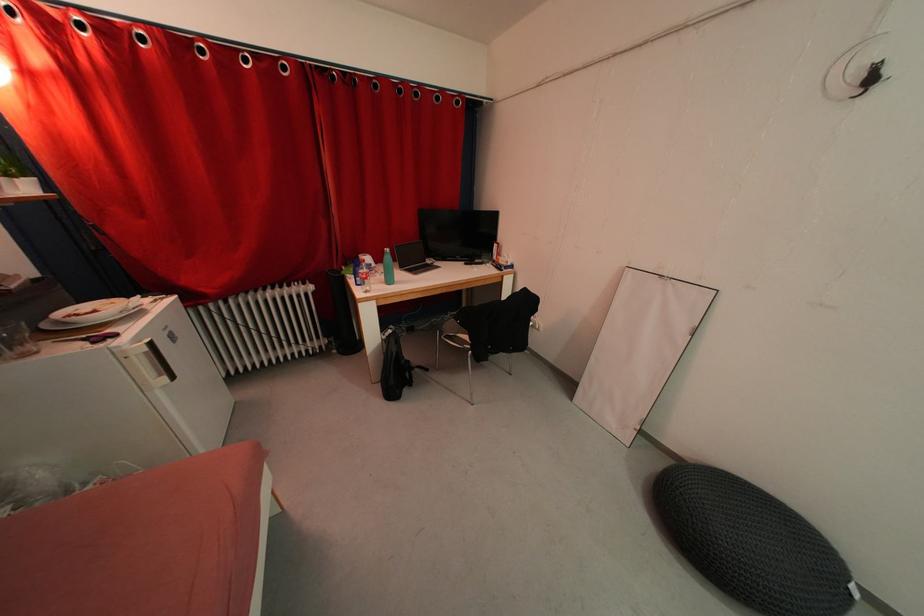
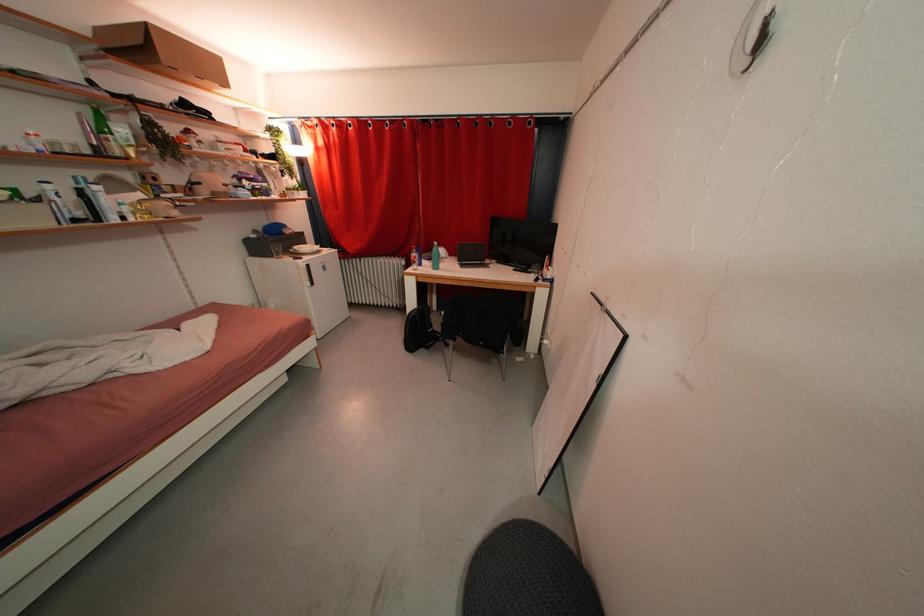
The point at (119, 346) is marked in the first image. Where is the corresponding point in the second image?

(305, 265)